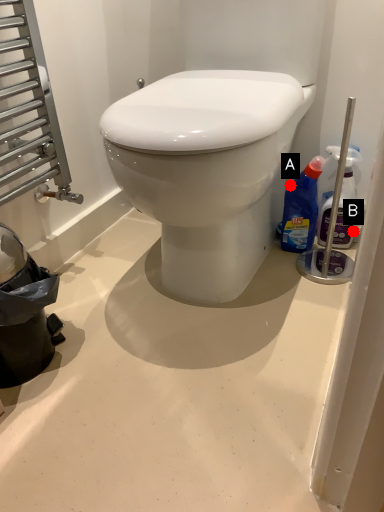
Question: Two points are circled on the image, labeled by A and B beside each circle. Which of the following is the closest to the observer?

Choices:
 (A) A is closer
 (B) B is closer

Answer: (A)